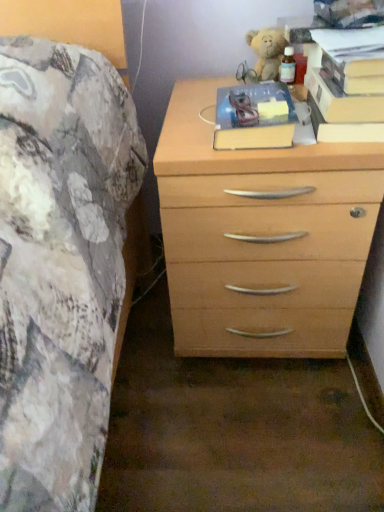
Question: Is light wood chest of drawers at right positioned before hardcover book at upper right, placed as the 2th paperback book when sorted from left to right?

Choices:
 (A) no
 (B) yes

Answer: (B)

Question: From a real-world perspective, is light wood chest of drawers at right located beneath hardcover book at upper right, placed as the 2th paperback book when sorted from left to right?

Choices:
 (A) no
 (B) yes

Answer: (B)

Question: From the image's perspective, is light wood chest of drawers at right on hardcover book at upper right, placed as the 2th paperback book when sorted from left to right?

Choices:
 (A) no
 (B) yes

Answer: (A)

Question: Is light wood chest of drawers at right further to camera compared to hardcover book at upper right, which ranks as the 2th paperback book in right-to-left order?

Choices:
 (A) no
 (B) yes

Answer: (A)

Question: Considering the relative sizes of light wood chest of drawers at right and hardcover book at upper right, which ranks as the 2th paperback book in right-to-left order, in the image provided, is light wood chest of drawers at right wider than hardcover book at upper right, which ranks as the 2th paperback book in right-to-left order,?

Choices:
 (A) yes
 (B) no

Answer: (A)

Question: Is light wood chest of drawers at right not inside hardcover book at upper right, which ranks as the 2th paperback book in right-to-left order?

Choices:
 (A) yes
 (B) no

Answer: (A)

Question: Would you consider hardcover book at upper right, marked as the first paperback book in a right-to-left arrangement, to be distant from light wood chest of drawers at right?

Choices:
 (A) no
 (B) yes

Answer: (A)

Question: Can you confirm if hardcover book at upper right, placed as the third paperback book when sorted from left to right, is smaller than light wood chest of drawers at right?

Choices:
 (A) yes
 (B) no

Answer: (A)

Question: Is hardcover book at upper right, marked as the first paperback book in a right-to-left arrangement, taller than light wood chest of drawers at right?

Choices:
 (A) yes
 (B) no

Answer: (B)

Question: Is hardcover book at upper right, marked as the first paperback book in a right-to-left arrangement, to the left of light wood chest of drawers at right from the viewer's perspective?

Choices:
 (A) no
 (B) yes

Answer: (A)

Question: Does hardcover book at upper right, placed as the third paperback book when sorted from left to right, have a greater width compared to light wood chest of drawers at right?

Choices:
 (A) no
 (B) yes

Answer: (A)

Question: Is hardcover book at upper right, marked as the first paperback book in a right-to-left arrangement, turned away from light wood chest of drawers at right?

Choices:
 (A) yes
 (B) no

Answer: (B)

Question: Is hardcover book at center, which appears as the 1th paperback book when viewed from the left, not within hardcover book at upper right, placed as the 2th paperback book when sorted from left to right?

Choices:
 (A) no
 (B) yes

Answer: (B)